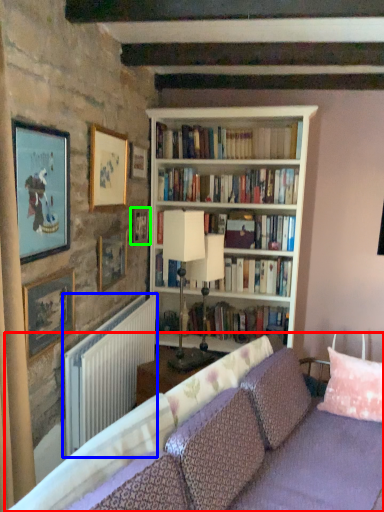
Question: Which object is the farthest from studio couch (highlighted by a red box)? Choose among these: radiator (highlighted by a blue box) or picture frame (highlighted by a green box).

Choices:
 (A) radiator
 (B) picture frame

Answer: (B)